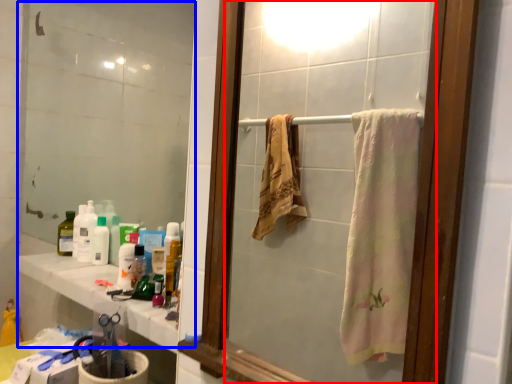
Question: Which point is further to the camera, mirror (highlighted by a red box) or mirror (highlighted by a blue box)?

Choices:
 (A) mirror
 (B) mirror

Answer: (B)